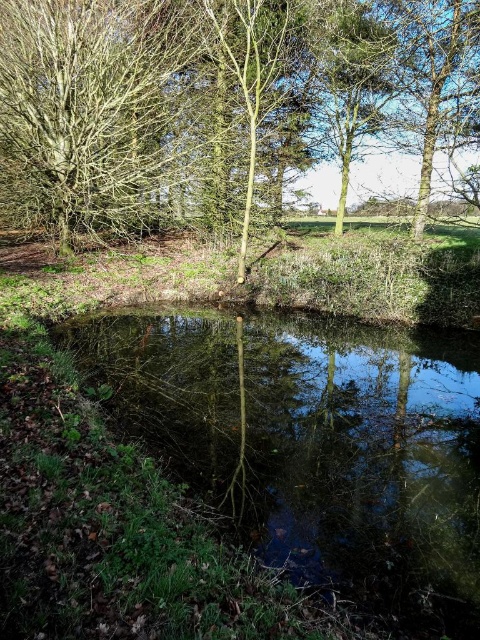
Can you confirm if green matte tree at center is positioned above green reflective water at center?

Indeed, green matte tree at center is positioned over green reflective water at center.

Who is positioned more to the left, green matte tree at center or green reflective water at center?

From the viewer's perspective, green reflective water at center appears more on the left side.

Where is `green matte tree at center`? Image resolution: width=480 pixels, height=640 pixels. green matte tree at center is located at coordinates (219, 106).